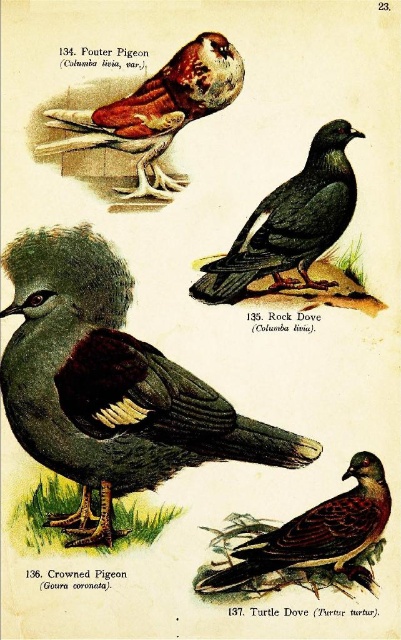
Is the position of shiny blue-green bird at center more distant than that of shiny black rock dove at center?

No, shiny blue-green bird at center is closer to the viewer.

Is point (172, 397) behind point (297, 209)?

No.

Is point (228, 419) closer to viewer compared to point (342, 122)?

That is True.

Identify the location of shiny blue-green bird at center. The height and width of the screenshot is (640, 401). (109, 385).

Is point (234, 449) farther from viewer compared to point (206, 33)?

No, (234, 449) is closer to viewer.

Does shiny blue-green bird at center appear on the left side of matte brown feathers at upper left?

Correct, you'll find shiny blue-green bird at center to the left of matte brown feathers at upper left.

At what (x,y) coordinates should I click in order to perform the action: click on shiny blue-green bird at center. Please return your answer as a coordinate pair (x, y). Looking at the image, I should click on (109, 385).

Is shiny black rock dove at center below matte brown feathers at upper left?

Indeed, shiny black rock dove at center is positioned under matte brown feathers at upper left.

I want to click on shiny black rock dove at center, so click(289, 224).